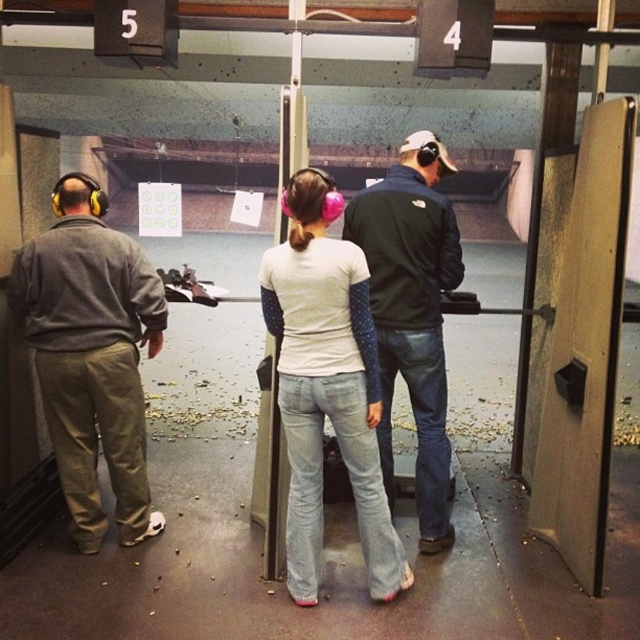
Does matte gray hoodie at left appear over dark blue jacket at center?

No, matte gray hoodie at left is not above dark blue jacket at center.

How much distance is there between matte gray hoodie at left and dark blue jacket at center?

matte gray hoodie at left is 4.21 feet away from dark blue jacket at center.

Image resolution: width=640 pixels, height=640 pixels. Describe the element at coordinates (92, 355) in the screenshot. I see `matte gray hoodie at left` at that location.

Locate an element on the screen. matte gray hoodie at left is located at coordinates (92, 355).